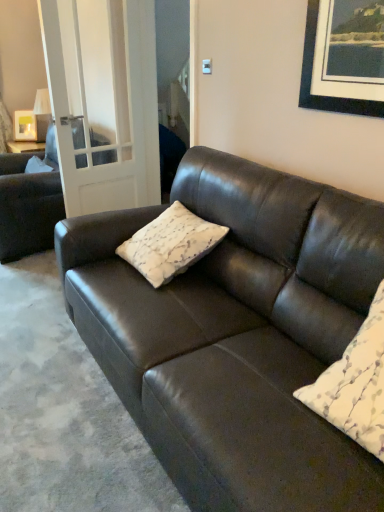
Question: Is white textured pillow at center, the 2th pillow positioned from the front, to the right of clear glass door at left from the viewer's perspective?

Choices:
 (A) yes
 (B) no

Answer: (A)

Question: Is white textured pillow at center, placed as the first pillow when sorted from left to right, further to the viewer compared to clear glass door at left?

Choices:
 (A) no
 (B) yes

Answer: (A)

Question: From the image's perspective, is white textured pillow at center, marked as the 1th pillow in a back-to-front arrangement, beneath clear glass door at left?

Choices:
 (A) yes
 (B) no

Answer: (A)

Question: Considering the relative sizes of white textured pillow at center, marked as the 1th pillow in a back-to-front arrangement, and clear glass door at left in the image provided, is white textured pillow at center, marked as the 1th pillow in a back-to-front arrangement, shorter than clear glass door at left?

Choices:
 (A) yes
 (B) no

Answer: (A)

Question: Can you confirm if white textured pillow at center, the 2th pillow positioned from the front, is smaller than clear glass door at left?

Choices:
 (A) no
 (B) yes

Answer: (B)

Question: Considering the relative positions of white textured pillow at center, placed as the first pillow when sorted from left to right, and clear glass door at left in the image provided, is white textured pillow at center, placed as the first pillow when sorted from left to right, to the left or to the right of clear glass door at left?

Choices:
 (A) left
 (B) right

Answer: (B)

Question: Based on their sizes in the image, would you say white textured pillow at center, marked as the 1th pillow in a back-to-front arrangement, is bigger or smaller than clear glass door at left?

Choices:
 (A) small
 (B) big

Answer: (A)

Question: From a real-world perspective, relative to clear glass door at left, is white textured pillow at center, placed as the first pillow when sorted from left to right, vertically above or below?

Choices:
 (A) above
 (B) below

Answer: (B)

Question: Do you think white textured pillow at center, the 2th pillow positioned from the front, is within clear glass door at left, or outside of it?

Choices:
 (A) inside
 (B) outside

Answer: (B)

Question: Which is correct: matte black couch at left, arranged as the first studio couch when viewed from the left, is inside matte white picture frame at upper left, or outside of it?

Choices:
 (A) outside
 (B) inside

Answer: (A)

Question: From a real-world perspective, is matte black couch at left, placed as the second studio couch when sorted from front to back, positioned above or below matte white picture frame at upper left?

Choices:
 (A) above
 (B) below

Answer: (B)

Question: Looking at their shapes, would you say matte black couch at left, which is the second studio couch from right to left, is wider or thinner than matte white picture frame at upper left?

Choices:
 (A) thin
 (B) wide

Answer: (B)

Question: In the image, is matte black couch at left, which is the second studio couch from right to left, positioned in front of or behind matte white picture frame at upper left?

Choices:
 (A) front
 (B) behind

Answer: (A)

Question: Is white textured pillow at center, acting as the 2th pillow starting from the back, situated inside matte white picture frame at upper left or outside?

Choices:
 (A) inside
 (B) outside

Answer: (B)

Question: From the image's perspective, is white textured pillow at center, acting as the first pillow starting from the front, positioned above or below matte white picture frame at upper left?

Choices:
 (A) above
 (B) below

Answer: (B)